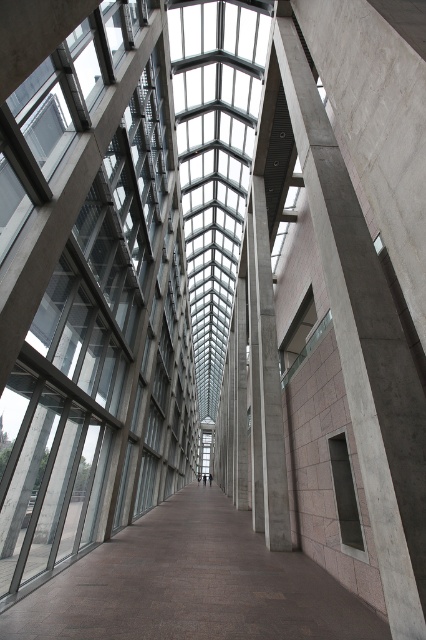
Question: Which of the following is the closest to the observer?

Choices:
 (A) (276, 406)
 (B) (215, 493)

Answer: (A)

Question: In this image, where is smooth concrete floor at center located relative to concrete pillar at center?

Choices:
 (A) right
 (B) left

Answer: (B)

Question: Among these objects, which one is farthest from the camera?

Choices:
 (A) smooth concrete floor at center
 (B) concrete pillar at center

Answer: (B)

Question: Observing the image, what is the correct spatial positioning of smooth concrete floor at center in reference to concrete pillar at center?

Choices:
 (A) left
 (B) right

Answer: (A)

Question: Observing the image, what is the correct spatial positioning of smooth concrete floor at center in reference to concrete pillar at center?

Choices:
 (A) above
 (B) below

Answer: (B)